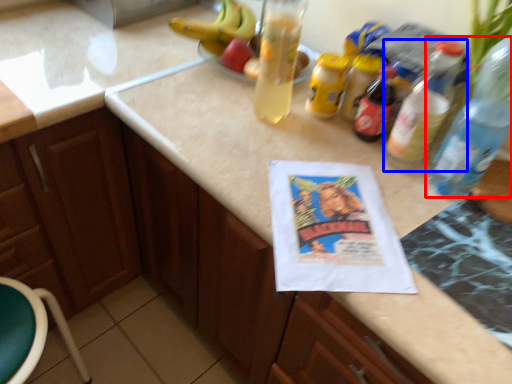
Question: Which object is closer to the camera taking this photo, bottle (highlighted by a red box) or bottle (highlighted by a blue box)?

Choices:
 (A) bottle
 (B) bottle

Answer: (A)